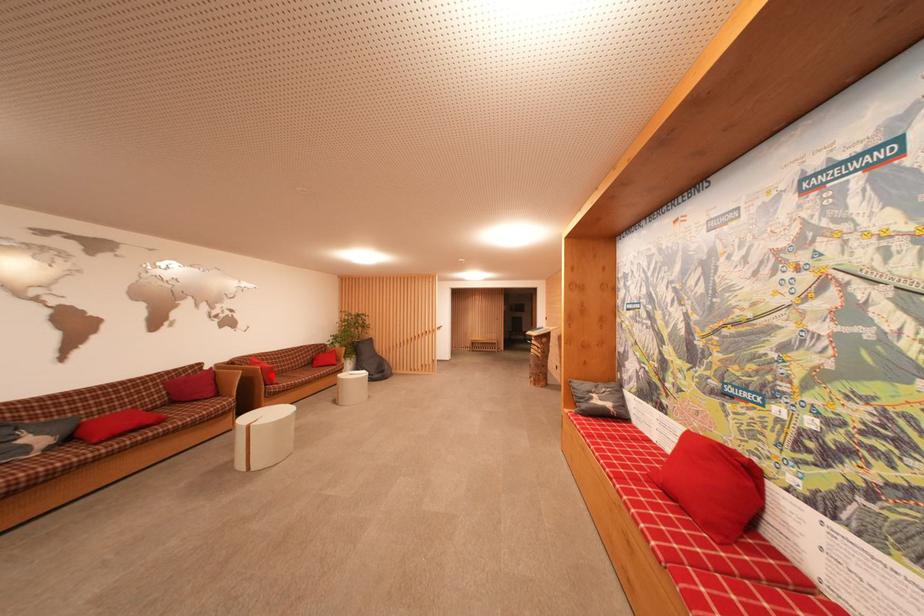
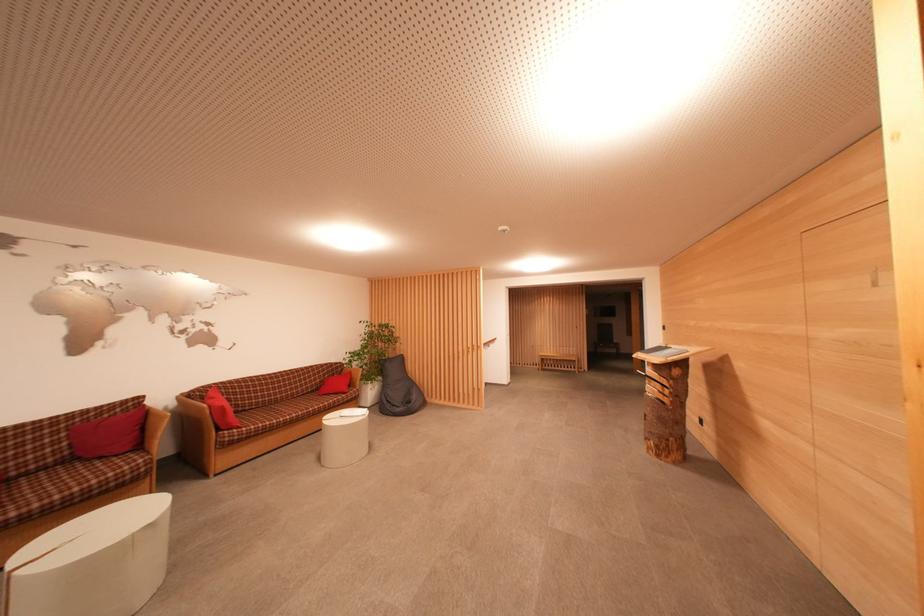
Locate, in the second image, the point that corresponds to the highlighted location in the first image.

(223, 416)